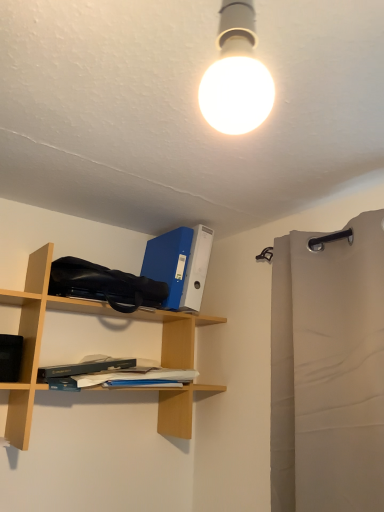
Question: Is beige fabric curtain at right looking in the opposite direction of beech wood shelf at left?

Choices:
 (A) yes
 (B) no

Answer: (B)

Question: Considering the relative sizes of beige fabric curtain at right and beech wood shelf at left in the image provided, is beige fabric curtain at right bigger than beech wood shelf at left?

Choices:
 (A) no
 (B) yes

Answer: (A)

Question: Is beige fabric curtain at right to the left of beech wood shelf at left from the viewer's perspective?

Choices:
 (A) yes
 (B) no

Answer: (B)

Question: From a real-world perspective, is beige fabric curtain at right physically below beech wood shelf at left?

Choices:
 (A) yes
 (B) no

Answer: (A)

Question: From the image's perspective, would you say beige fabric curtain at right is shown under beech wood shelf at left?

Choices:
 (A) no
 (B) yes

Answer: (B)

Question: Does point (112, 380) appear closer or farther from the camera than point (49, 305)?

Choices:
 (A) farther
 (B) closer

Answer: (B)

Question: Would you say hardcover book at center is to the left or to the right of beech wood shelf at left in the picture?

Choices:
 (A) right
 (B) left

Answer: (A)

Question: From a real-world perspective, relative to beech wood shelf at left, is hardcover book at center vertically above or below?

Choices:
 (A) below
 (B) above

Answer: (A)

Question: Do you think hardcover book at center is within beech wood shelf at left, or outside of it?

Choices:
 (A) outside
 (B) inside

Answer: (B)

Question: Is point (180, 315) closer or farther from the camera than point (89, 382)?

Choices:
 (A) farther
 (B) closer

Answer: (A)

Question: Considering their positions, is beech wood shelf at left located in front of or behind hardcover book at center?

Choices:
 (A) front
 (B) behind

Answer: (A)

Question: Based on their sizes in the image, would you say beech wood shelf at left is bigger or smaller than hardcover book at center?

Choices:
 (A) big
 (B) small

Answer: (A)

Question: Choose the correct answer: Is beech wood shelf at left inside hardcover book at center or outside it?

Choices:
 (A) inside
 (B) outside

Answer: (B)

Question: From a real-world perspective, is beige fabric curtain at right above or below hardcover book at center?

Choices:
 (A) above
 (B) below

Answer: (A)

Question: Is point (339, 264) positioned closer to the camera than point (140, 372)?

Choices:
 (A) farther
 (B) closer

Answer: (B)